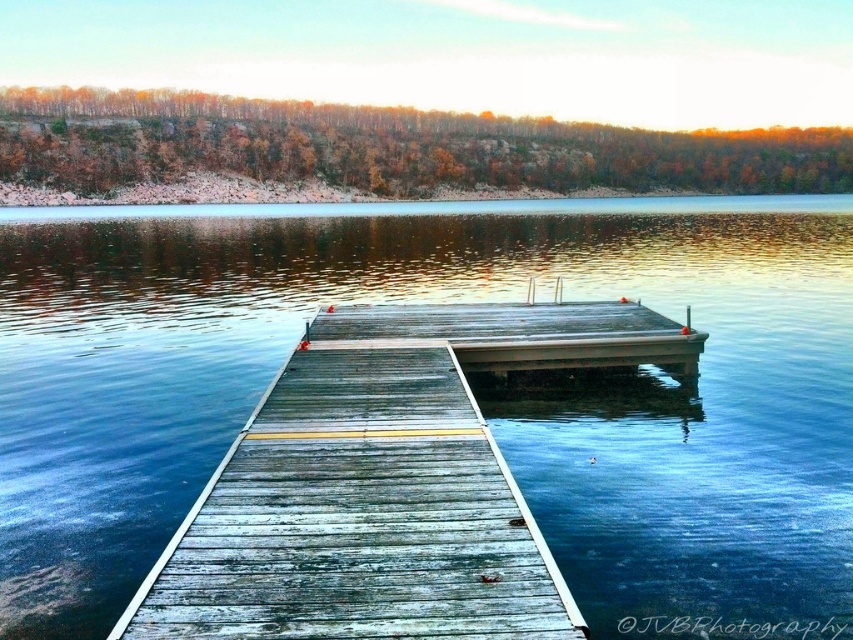
Between transparent blue water at center and weathered wood dock at center, which one is positioned higher?

transparent blue water at center is higher up.

Between point (198, 298) and point (299, 604), which one is positioned behind?

The point (198, 298) is more distant.

Is point (221, 275) in front of point (465, 396)?

No, it is not.

What are the coordinates of `transparent blue water at center` in the screenshot? It's located at (469, 381).